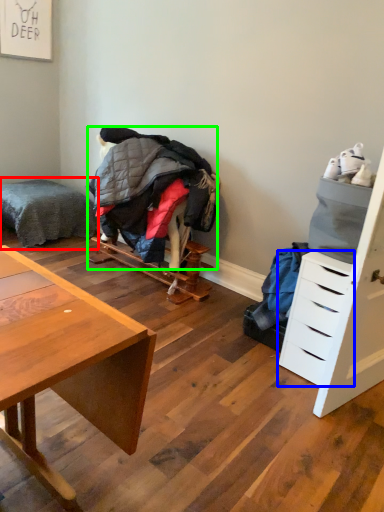
Question: Considering the real-world distances, which object is closest to bed (highlighted by a red box)? drawer (highlighted by a blue box) or clothing (highlighted by a green box).

Choices:
 (A) drawer
 (B) clothing

Answer: (B)